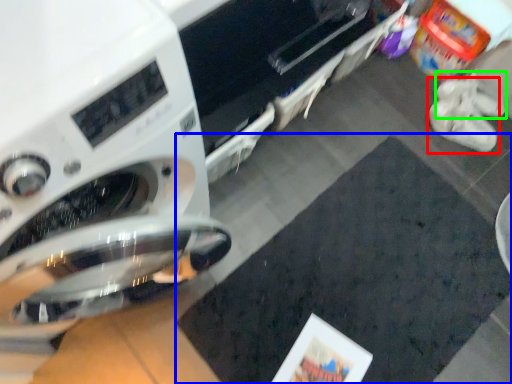
Question: Which object is the farthest from footwear (highlighted by a red box)? Choose among these: mat (highlighted by a blue box) or shoe (highlighted by a green box).

Choices:
 (A) mat
 (B) shoe

Answer: (A)